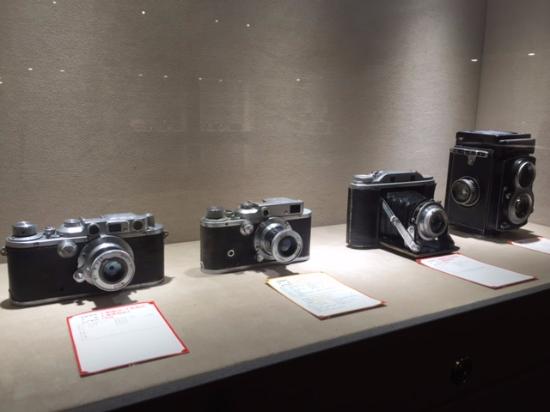
The height and width of the screenshot is (412, 550). I want to click on countertop, so click(254, 337).